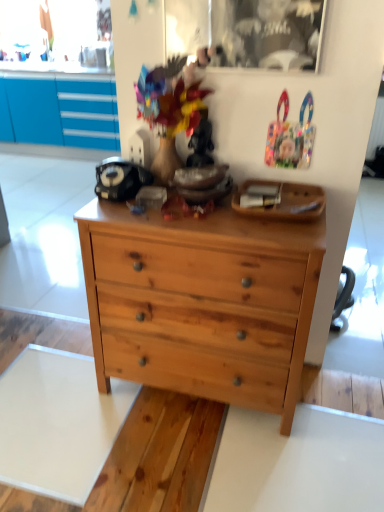
Question: From a real-world perspective, does natural wood chest of drawers at center stand above wooden tray at upper center?

Choices:
 (A) yes
 (B) no

Answer: (B)

Question: Is natural wood chest of drawers at center not within wooden tray at upper center?

Choices:
 (A) yes
 (B) no

Answer: (A)

Question: Is natural wood chest of drawers at center bigger than wooden tray at upper center?

Choices:
 (A) yes
 (B) no

Answer: (A)

Question: Is natural wood chest of drawers at center at the right side of wooden tray at upper center?

Choices:
 (A) yes
 (B) no

Answer: (B)

Question: Is natural wood chest of drawers at center to the left of wooden tray at upper center from the viewer's perspective?

Choices:
 (A) no
 (B) yes

Answer: (B)

Question: Does natural wood chest of drawers at center have a lesser height compared to wooden tray at upper center?

Choices:
 (A) yes
 (B) no

Answer: (B)

Question: Is wooden tray at upper center turned away from natural wood chest of drawers at center?

Choices:
 (A) no
 (B) yes

Answer: (A)

Question: Considering the relative positions of wooden tray at upper center and natural wood chest of drawers at center in the image provided, is wooden tray at upper center behind natural wood chest of drawers at center?

Choices:
 (A) yes
 (B) no

Answer: (A)

Question: Can you confirm if wooden tray at upper center is wider than natural wood chest of drawers at center?

Choices:
 (A) yes
 (B) no

Answer: (B)

Question: Could you tell me if wooden tray at upper center is turned towards natural wood chest of drawers at center?

Choices:
 (A) yes
 (B) no

Answer: (B)

Question: Considering the relative sizes of wooden tray at upper center and natural wood chest of drawers at center in the image provided, is wooden tray at upper center shorter than natural wood chest of drawers at center?

Choices:
 (A) yes
 (B) no

Answer: (A)

Question: Is wooden tray at upper center bigger than natural wood chest of drawers at center?

Choices:
 (A) no
 (B) yes

Answer: (A)

Question: From a real-world perspective, is wooden tray at upper center located beneath transparent glass picture frame at upper center?

Choices:
 (A) yes
 (B) no

Answer: (A)